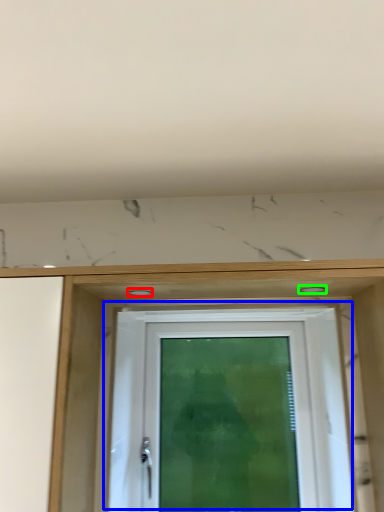
Question: Which is nearer to the hole (highlighted by a red box)? door (highlighted by a blue box) or hole (highlighted by a green box).

Choices:
 (A) door
 (B) hole

Answer: (B)